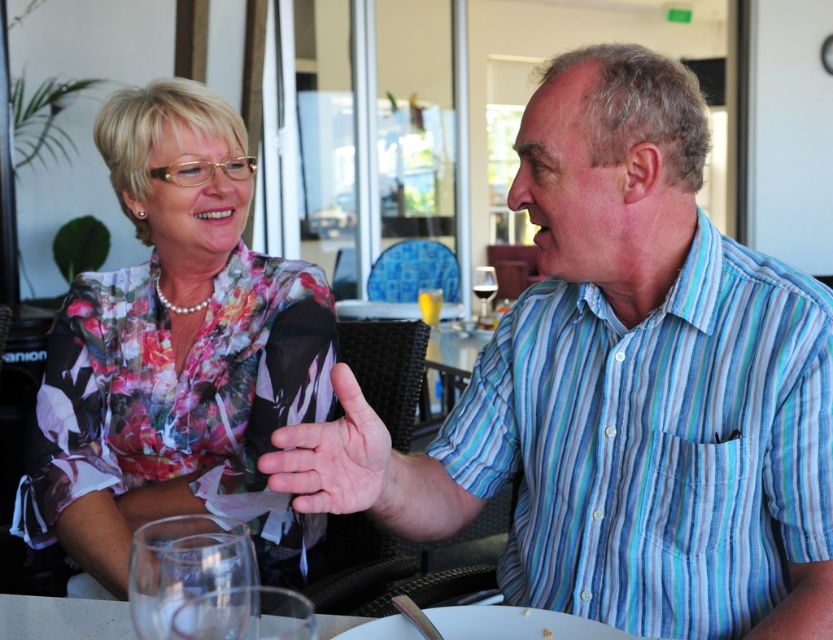
Question: Does blue striped shirt at center have a larger size compared to smooth skin hand at center?

Choices:
 (A) yes
 (B) no

Answer: (A)

Question: Based on their relative distances, which object is farther from the transparent glass at upper center?

Choices:
 (A) smooth skin hand at center
 (B) transparent glass at lower left

Answer: (B)

Question: Observing the image, what is the correct spatial positioning of blue striped shirt at center in reference to floral fabric blouse at upper left?

Choices:
 (A) left
 (B) right

Answer: (B)

Question: Which of these objects is positioned farthest from the floral fabric blouse at upper left?

Choices:
 (A) white glossy table at lower center
 (B) blue striped shirt at center

Answer: (B)

Question: Which of the following is the farthest from the observer?

Choices:
 (A) (642, 100)
 (B) (51, 614)

Answer: (B)

Question: Is floral fabric blouse at upper left thinner than smooth skin hand at center?

Choices:
 (A) yes
 (B) no

Answer: (B)